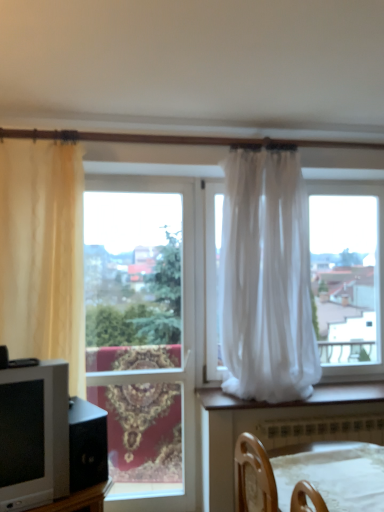
Question: Based on their positions, is beige sheer curtain at left, acting as the 2th curtain starting from the right, located to the left or right of matte gray tv at left?

Choices:
 (A) left
 (B) right

Answer: (A)

Question: In the image, is beige sheer curtain at left, acting as the 2th curtain starting from the right, positioned in front of or behind matte gray tv at left?

Choices:
 (A) behind
 (B) front

Answer: (A)

Question: Which is farther from the white plastic radiator at lower center?

Choices:
 (A) beige sheer curtain at left, which is counted as the 1th curtain, starting from the left
 (B) clear glass window at center
 (C) matte gray tv at left
 (D) wooden chair at lower center
 (E) white sheer curtain at center, which ranks as the 1th curtain in right-to-left order

Answer: (A)

Question: Estimate the real-world distances between objects in this image. Which object is closer to the matte gray tv at left?

Choices:
 (A) white plastic radiator at lower center
 (B) beige sheer curtain at left, acting as the 2th curtain starting from the right
 (C) wooden chair at lower center
 (D) clear glass window at center
 (E) white sheer curtain at center, which ranks as the 1th curtain in right-to-left order

Answer: (B)